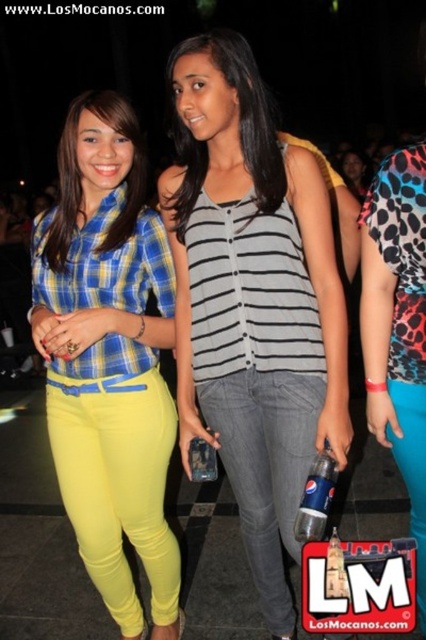
You are at a party and want to find the person wearing the leopard print dress at right. Which direction should you look relative to the matte yellow pants at lower left?

The leopard print dress at right is to the right of the matte yellow pants at lower left, so you should look to the right of the matte yellow pants at lower left to find the leopard print dress at right.

You are a photographer standing at the camera position. You want to capture a closeup shot of the matte yellow pants at lower left. Given that the camera can focus on objects within 5 feet, will you need to move closer or further away to get a clear closeup?

The matte yellow pants at lower left is 6.10 feet away from camera. Since the camera can focus within 5 feet, you need to move closer to reduce the distance to within 5 feet for a clear closeup.

You are at a party and want to know which clothing item is higher up between the gray denim jeans at center and the striped fabric top at center. Which one is taller?

The gray denim jeans at center is taller than the striped fabric top at center according to the description.